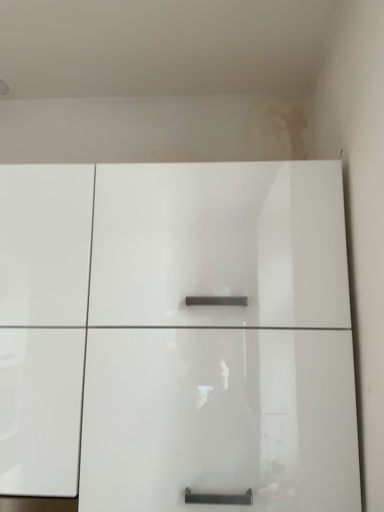
Question: Should I look upward or downward to see glossy white cupboard at center?

Choices:
 (A) down
 (B) up

Answer: (A)